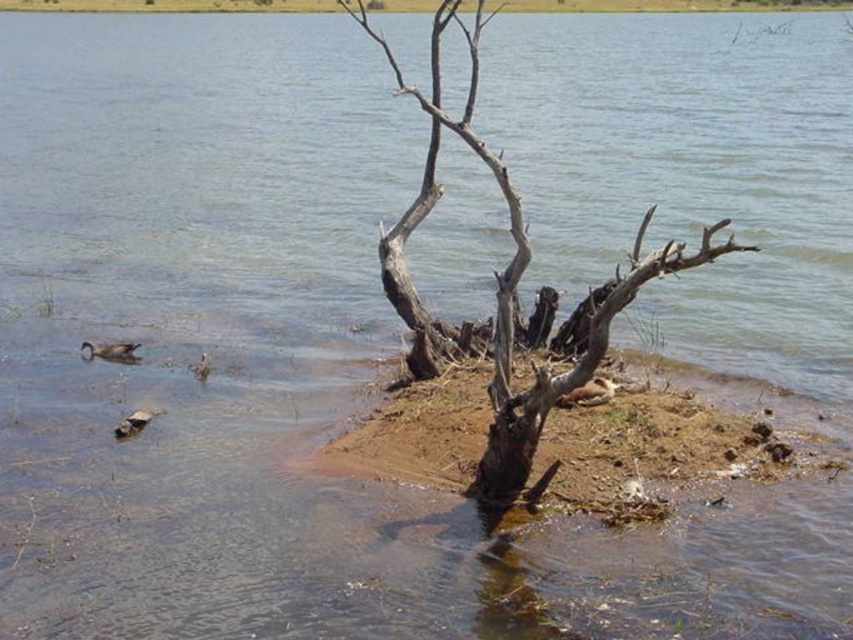
You are standing on the lakeside and see the brown dirt shoreline at center and the brown feathered duck at center. Which object is positioned to the right of the other?

The brown dirt shoreline at center is to the right of the brown feathered duck at center.

You are standing at the edge of the lake and want to reach the island. You notice two points marked on the water surface. The first point is located at coordinates point (438, 96) and the second at point (86, 346). Which of these points is closer to the island?

Point (438, 96) is in front of point (86, 346), so it is closer to the island.